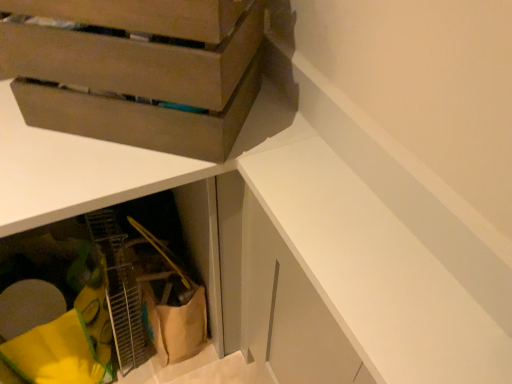
You are a GUI agent. You are given a task and a screenshot of the screen. Output one action in this format:
    pyautogui.click(x=<x>, y=<y>)
    Task: Click on the vacant space underneath white matte cabinet at upper right, which is the 2th cabinetry from left to right (from a real-world perspective)
    
    Given the screenshot: What is the action you would take?
    pyautogui.click(x=362, y=182)